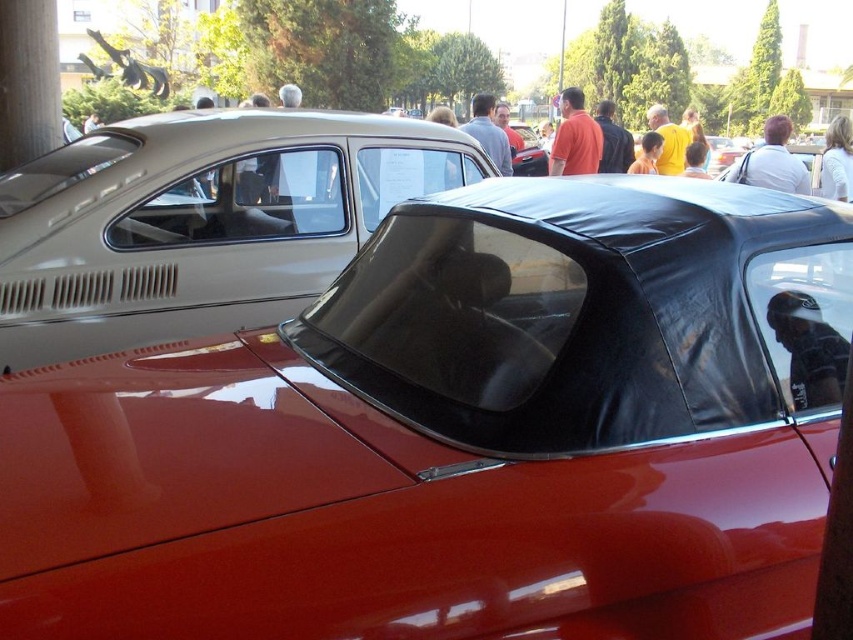
Describe the element at coordinates (808, 349) in the screenshot. The image size is (853, 640). I see `dark gray leather jacket at upper right` at that location.

Between dark gray leather jacket at upper right and white fabric shirt at upper right, which one is positioned higher?

white fabric shirt at upper right is higher up.

At what (x,y) coordinates should I click in order to perform the action: click on dark gray leather jacket at upper right. Please return your answer as a coordinate pair (x, y). Image resolution: width=853 pixels, height=640 pixels. Looking at the image, I should click on (808, 349).

This screenshot has height=640, width=853. In order to click on dark gray leather jacket at upper right in this screenshot , I will do `click(808, 349)`.

Is the position of dark gray leather jacket at upper right more distant than that of matte orange shirt at upper center?

No, dark gray leather jacket at upper right is closer to the viewer.

Based on the photo, between dark gray leather jacket at upper right and matte orange shirt at upper center, which one has more height?

With more height is matte orange shirt at upper center.

Is point (798, 316) positioned behind point (560, 141)?

No, (798, 316) is closer to viewer.

Image resolution: width=853 pixels, height=640 pixels. I want to click on dark gray leather jacket at upper right, so click(808, 349).

Who is shorter, matte orange shirt at upper center or yellow shirt at center?

yellow shirt at center is shorter.

Which is above, matte orange shirt at upper center or yellow shirt at center?

Positioned higher is yellow shirt at center.

Identify the location of matte orange shirt at upper center. Image resolution: width=853 pixels, height=640 pixels. (575, 138).